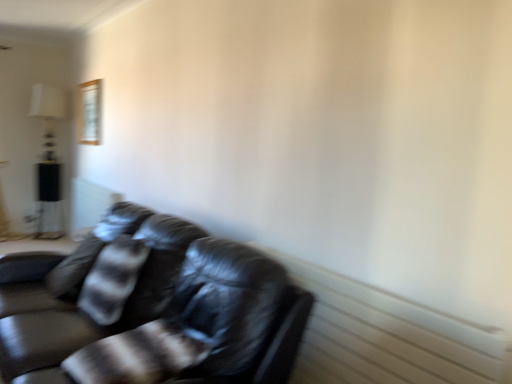
Question: Does point pos(97,94) appear closer or farther from the camera than point pos(58,258)?

Choices:
 (A) closer
 (B) farther

Answer: (B)

Question: In terms of height, does wooden frame at upper left look taller or shorter compared to shiny black leather couch at lower left?

Choices:
 (A) short
 (B) tall

Answer: (A)

Question: Which object is the farthest from the shiny black leather couch at lower left?

Choices:
 (A) wooden frame at upper left
 (B) white fabric lampshade at upper left
 (C) striped fabric pillow at left
 (D) black glossy table at left

Answer: (B)

Question: Which object is positioned closest to the striped fabric pillow at left?

Choices:
 (A) shiny black leather couch at lower left
 (B) black glossy table at left
 (C) wooden frame at upper left
 (D) white fabric lampshade at upper left

Answer: (A)